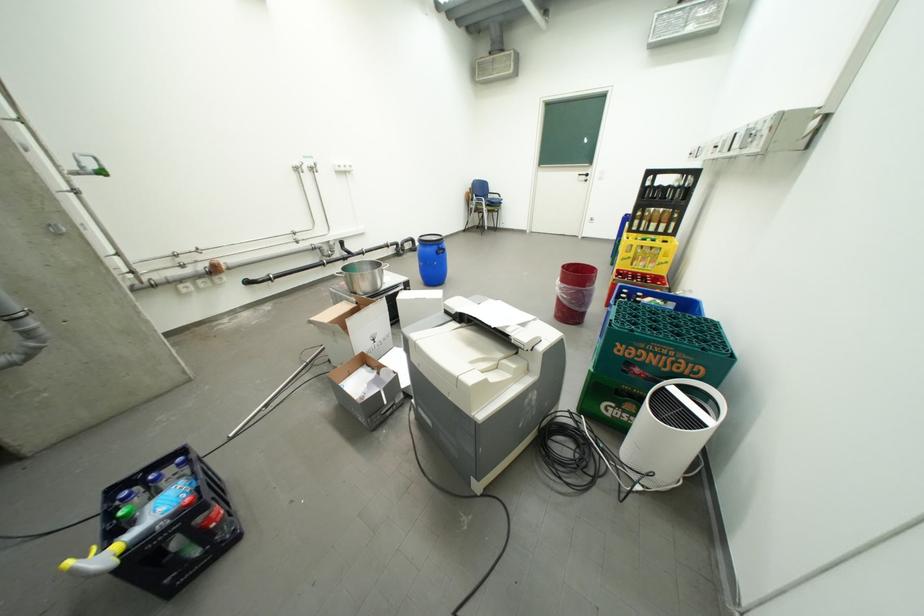
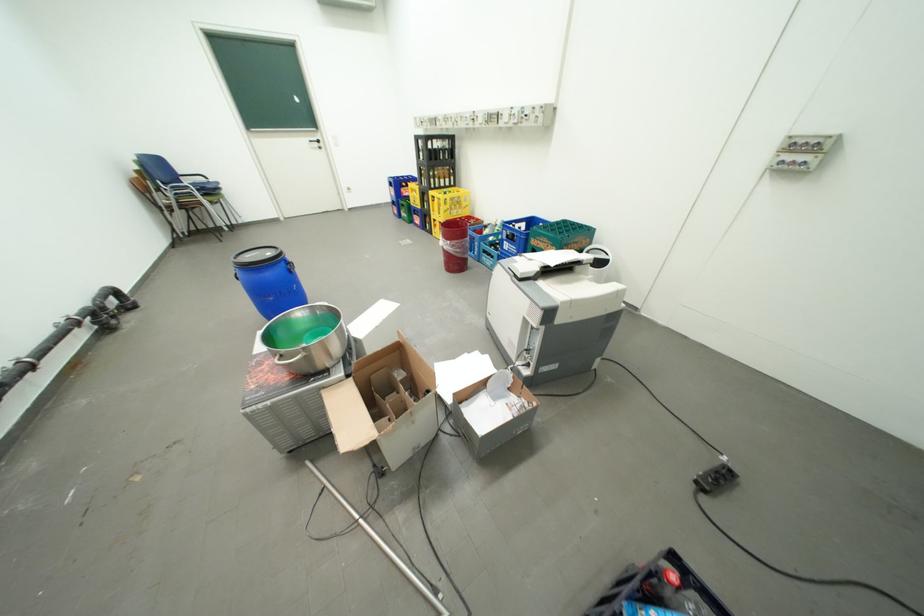
Where in the second image is the point corresponding to pixel 570 284 from the first image?

(459, 243)